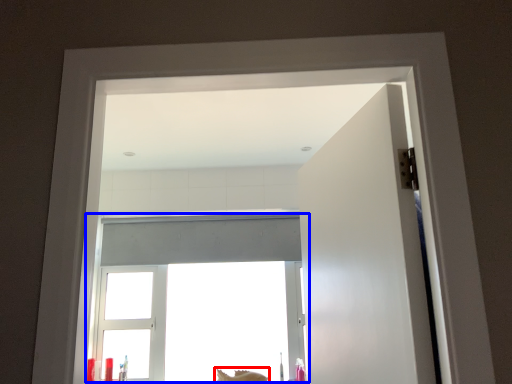
Question: Which object is closer to the camera taking this photo, animal (highlighted by a red box) or window (highlighted by a blue box)?

Choices:
 (A) animal
 (B) window

Answer: (A)